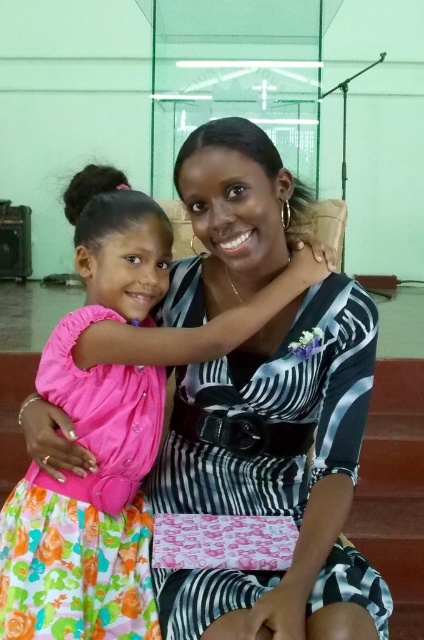
Question: Does pink satin dress at center have a smaller size compared to pink satin dress at left?

Choices:
 (A) yes
 (B) no

Answer: (B)

Question: Which point is closer to the camera?

Choices:
 (A) (137, 240)
 (B) (60, 381)

Answer: (B)

Question: Can you confirm if pink satin dress at center is wider than pink satin dress at left?

Choices:
 (A) no
 (B) yes

Answer: (B)

Question: Which point appears closest to the camera in this image?

Choices:
 (A) (141, 472)
 (B) (2, 604)

Answer: (B)

Question: Is pink satin dress at center above pink satin dress at left?

Choices:
 (A) yes
 (B) no

Answer: (A)